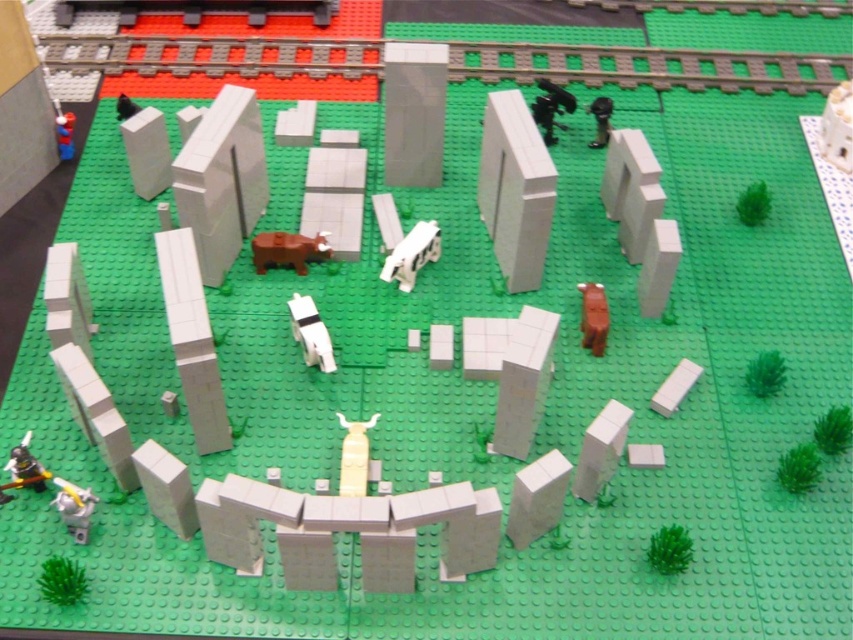
Does yellow matte vase at center have a lesser height compared to black plastic cow at upper right?

No.

Between point (370, 426) and point (601, 106), which one is positioned behind?

The point (601, 106) is behind.

Who is more distant from viewer, (358, 468) or (590, 147)?

The point (590, 147) is more distant.

Locate an element on the screen. The image size is (853, 640). yellow matte vase at center is located at coordinates (354, 456).

Does green matte brick at lower right have a greater height compared to smooth plastic superman at upper left?

Incorrect, green matte brick at lower right's height is not larger of smooth plastic superman at upper left's.

Is point (695, 369) in front of point (68, 120)?

Yes, it is.

Who is more forward, (660, 410) or (64, 152)?

Point (660, 410)

Where is `green matte brick at lower right`? The height and width of the screenshot is (640, 853). green matte brick at lower right is located at coordinates (674, 387).

Does white matte rectangular block at center appear on the left side of yellow matte vase at center?

No, white matte rectangular block at center is not to the left of yellow matte vase at center.

Which is behind, point (540, 177) or point (341, 456)?

Positioned behind is point (540, 177).

The width and height of the screenshot is (853, 640). Describe the element at coordinates (515, 189) in the screenshot. I see `white matte rectangular block at center` at that location.

At what (x,y) coordinates should I click in order to perform the action: click on white matte rectangular block at center. Please return your answer as a coordinate pair (x, y). The image size is (853, 640). Looking at the image, I should click on (515, 189).